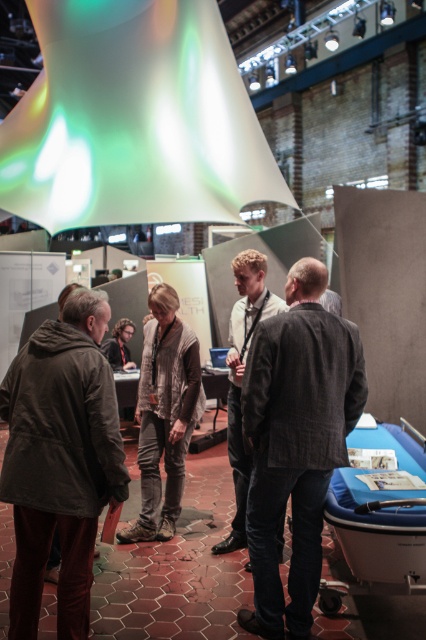
You are a photographer trying to capture a group photo of the dark gray textured jacket at center and the light brown leather jacket at center. Which jacket should you focus on first to ensure both are in frame?

The dark gray textured jacket at center is in front of the light brown leather jacket at center, so you should focus on the dark gray textured jacket at center first to ensure both are in frame.